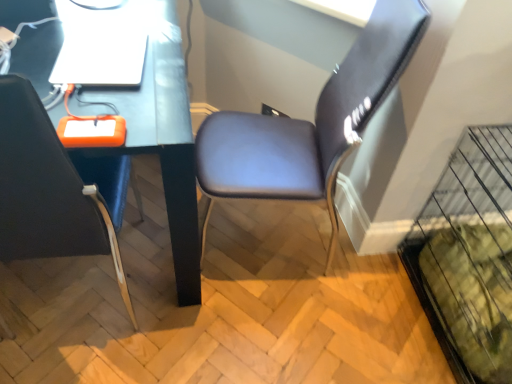
Identify the location of vacant space behind white glossy laptop at upper left. This screenshot has width=512, height=384. (116, 13).